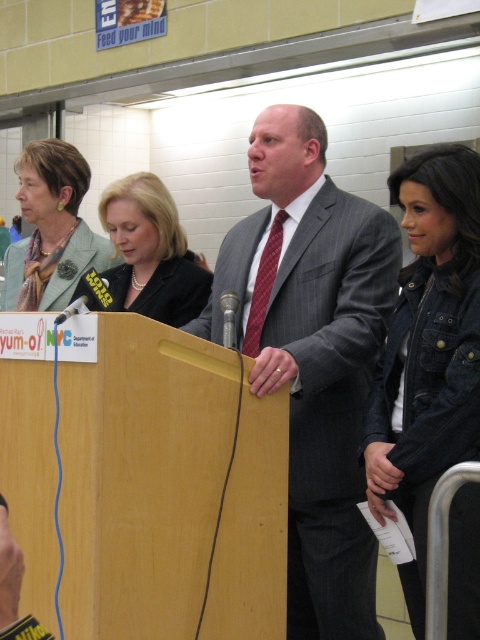
Is point (28, 216) positioned behind point (223, 321)?

Yes, it is behind point (223, 321).

Between matte green blazer at upper left and metallic silver microphone at center, which one is positioned higher?

matte green blazer at upper left is above.

Between point (35, 154) and point (224, 310), which one is positioned in front?

Point (224, 310)

Locate an element on the screen. Image resolution: width=480 pixels, height=640 pixels. matte green blazer at upper left is located at coordinates (51, 228).

Is gray pinstripe suit at center to the left of denim jacket at lower right from the viewer's perspective?

Correct, you'll find gray pinstripe suit at center to the left of denim jacket at lower right.

Which of these two, gray pinstripe suit at center or denim jacket at lower right, stands shorter?

Standing shorter between the two is denim jacket at lower right.

Who is more distant from viewer, (304, 358) or (453, 280)?

Positioned behind is point (453, 280).

You are a GUI agent. You are given a task and a screenshot of the screen. Output one action in this format:
    pyautogui.click(x=<x>, y=<y>)
    Task: Click on the gray pinstripe suit at center
    The height and width of the screenshot is (640, 480).
    Given the screenshot: What is the action you would take?
    pyautogui.click(x=312, y=355)

Where is `gray pinstripe suit at center`? gray pinstripe suit at center is located at coordinates (312, 355).

Which is in front, point (360, 429) or point (52, 236)?

Point (360, 429) is in front.

Is point (332, 244) in front of point (13, 307)?

Yes, it is in front of point (13, 307).

Find the location of a particular element. The width and height of the screenshot is (480, 640). gray pinstripe suit at center is located at coordinates (312, 355).